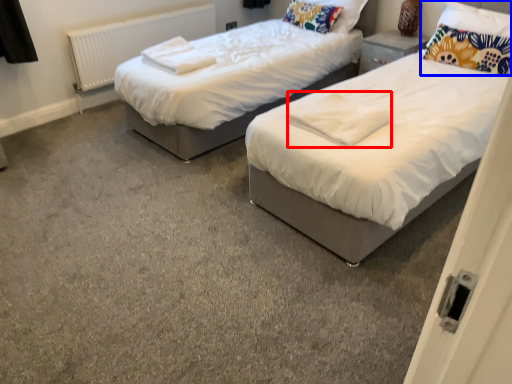
Question: Which object is further to the camera taking this photo, linen (highlighted by a red box) or pillow (highlighted by a blue box)?

Choices:
 (A) linen
 (B) pillow

Answer: (B)